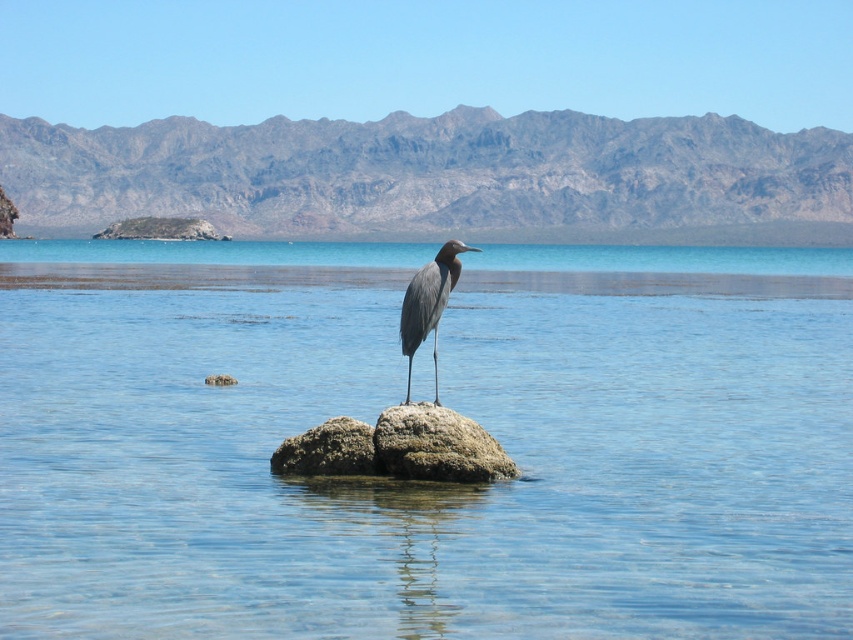
Question: Among these objects, which one is nearest to the camera?

Choices:
 (A) gray rocky mountains at upper center
 (B) rusty rock at center
 (C) gray matte bird at center
 (D) clear water at center

Answer: (D)

Question: Which point appears closest to the camera in this image?

Choices:
 (A) (363, 440)
 (B) (445, 282)
 (C) (462, 195)
 (D) (155, 632)

Answer: (D)

Question: Does rusty rock at center appear over rusty concrete rock at center?

Choices:
 (A) no
 (B) yes

Answer: (B)

Question: Is rusty rock at center below rusty concrete rock at center?

Choices:
 (A) yes
 (B) no

Answer: (B)

Question: Which of the following is the farthest from the observer?

Choices:
 (A) gray matte bird at center
 (B) rusty concrete rock at center

Answer: (B)

Question: Is gray rocky mountains at upper center above rusty rock at center?

Choices:
 (A) no
 (B) yes

Answer: (B)